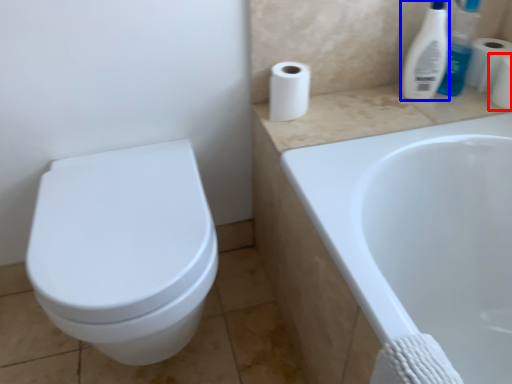
Question: Which point is further to the camera, toilet paper (highlighted by a red box) or cleaning product (highlighted by a blue box)?

Choices:
 (A) toilet paper
 (B) cleaning product

Answer: (A)